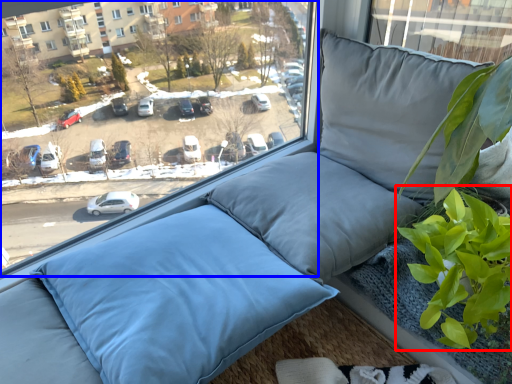
Question: Which point is closer to the camera, vegetation (highlighted by a red box) or window (highlighted by a blue box)?

Choices:
 (A) vegetation
 (B) window

Answer: (B)